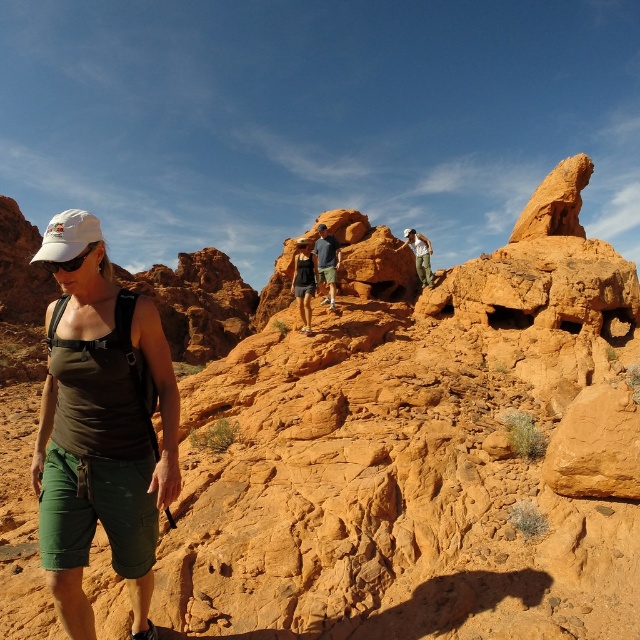
Question: Can you confirm if matte green shorts at center is smaller than matte black tank top at center?

Choices:
 (A) no
 (B) yes

Answer: (A)

Question: Which point is closer to the camera?

Choices:
 (A) (410, 243)
 (B) (140, 627)
 (C) (298, 308)

Answer: (B)

Question: Which object is positioned farthest from the matte green shorts at center?

Choices:
 (A) matte blue shirt at center
 (B) matte black tank top at center

Answer: (A)

Question: Which point is farther from the camera taking this photo?

Choices:
 (A) (296, 243)
 (B) (164, 365)
 (C) (420, 252)

Answer: (C)

Question: Observing the image, what is the correct spatial positioning of matte blue shirt at center in reference to matte khaki pants at center?

Choices:
 (A) below
 (B) above

Answer: (A)

Question: Does matte black tank top at center appear under matte blue shirt at center?

Choices:
 (A) yes
 (B) no

Answer: (A)